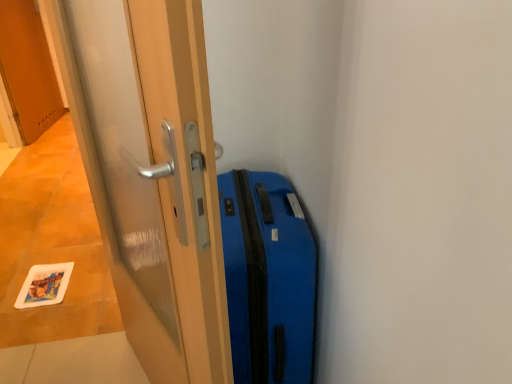
Question: Considering the positions of transparent glass door at center, which is the first door in right-to-left order, and wooden door at upper left, acting as the 1th door starting from the top, in the image, is transparent glass door at center, which is the first door in right-to-left order, taller or shorter than wooden door at upper left, acting as the 1th door starting from the top,?

Choices:
 (A) short
 (B) tall

Answer: (B)

Question: Considering the positions of transparent glass door at center, which is the 1th door in bottom-to-top order, and wooden door at upper left, which is the first door in left-to-right order, in the image, is transparent glass door at center, which is the 1th door in bottom-to-top order, wider or thinner than wooden door at upper left, which is the first door in left-to-right order,?

Choices:
 (A) thin
 (B) wide

Answer: (B)

Question: Estimate the real-world distances between objects in this image. Which object is farther from the blue matte suitcase at right?

Choices:
 (A) wooden door at upper left, acting as the 1th door starting from the top
 (B) transparent glass door at center, which is the first door in right-to-left order

Answer: (A)

Question: Which object is positioned farthest from the wooden door at upper left, the second door in the right-to-left sequence?

Choices:
 (A) transparent glass door at center, positioned as the second door in top-to-bottom order
 (B) blue matte suitcase at right

Answer: (B)